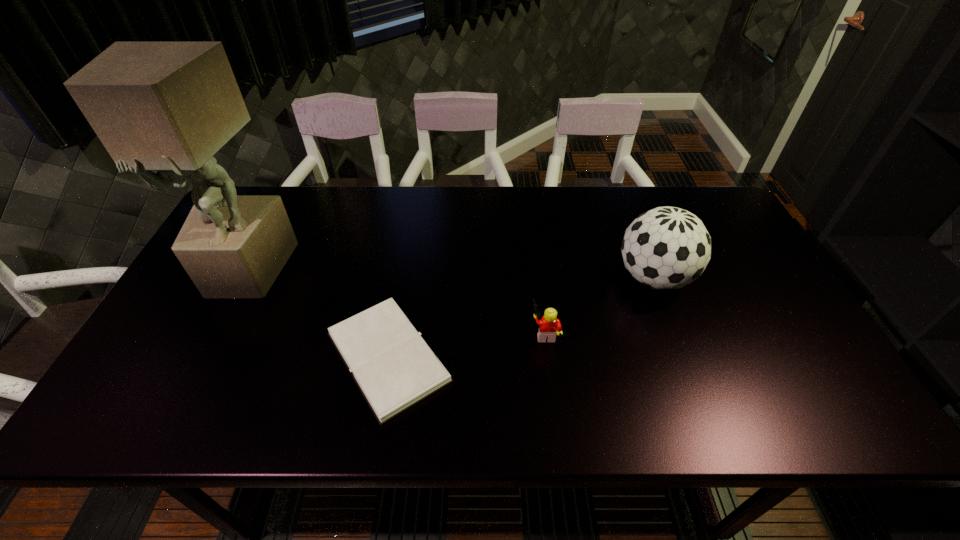
This screenshot has height=540, width=960. Find the location of `vacant space at the near right corner`. vacant space at the near right corner is located at coordinates (792, 397).

Find the location of `vacant space that is in between the second object from right to left and the leftmost object`. vacant space that is in between the second object from right to left and the leftmost object is located at coordinates (396, 301).

Find the location of `vacant point located between the sculpture and the third shortest object`. vacant point located between the sculpture and the third shortest object is located at coordinates (450, 274).

I want to click on free space between the third tallest object and the tallest object, so click(396, 301).

The height and width of the screenshot is (540, 960). What are the coordinates of `free space between the second shortest object and the second tallest object` in the screenshot? It's located at (599, 305).

Where is `vacant area that lies between the third object from right to left and the rightmost object`? vacant area that lies between the third object from right to left and the rightmost object is located at coordinates (520, 318).

Find the location of a particular element. The image size is (960, 540). free area in between the soccer ball and the sculpture is located at coordinates (450, 274).

Where is `blank region between the tallest object and the third shortest object`? blank region between the tallest object and the third shortest object is located at coordinates pyautogui.click(x=450, y=274).

The image size is (960, 540). In order to click on unoccupied area between the tallest object and the third object from left to right in this screenshot , I will do `click(396, 301)`.

What are the coordinates of `vacant area that lies between the hardback book and the second tallest object` in the screenshot? It's located at (520, 318).